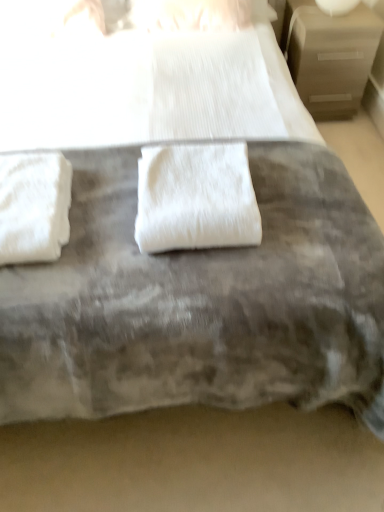
Question: From their relative heights in the image, would you say white fluffy towel at center, which ranks as the second towel in left-to-right order, is taller or shorter than white glossy table lamp at upper right?

Choices:
 (A) short
 (B) tall

Answer: (B)

Question: Would you say white fluffy towel at center, which is counted as the first towel, starting from the right, is to the left or to the right of white glossy table lamp at upper right in the picture?

Choices:
 (A) left
 (B) right

Answer: (A)

Question: Which is farther from the white fluffy towel at left, which is the first towel from left to right?

Choices:
 (A) white glossy table lamp at upper right
 (B) white fluffy towel at center, which ranks as the second towel in left-to-right order
 (C) beige wood nightstand at upper right

Answer: (A)

Question: Considering the real-world distances, which object is closest to the beige wood nightstand at upper right?

Choices:
 (A) white glossy table lamp at upper right
 (B) white fluffy towel at center, which is counted as the first towel, starting from the right
 (C) white fluffy towel at left, which is the first towel from left to right

Answer: (A)